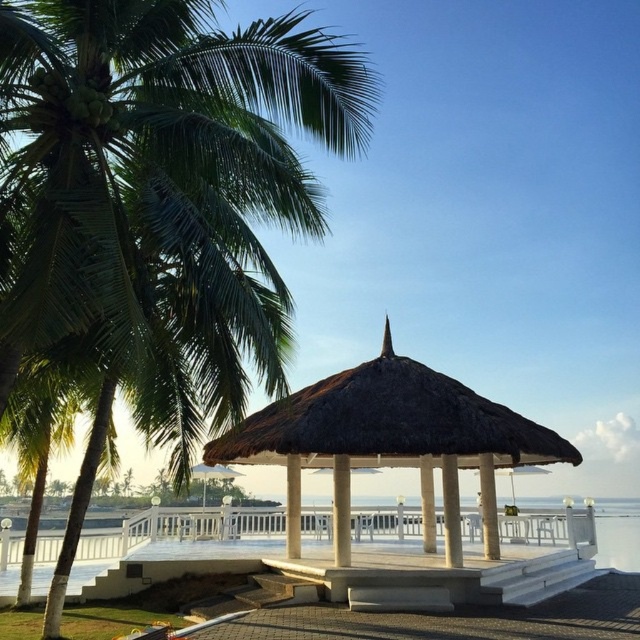
Question: Is green leafy palm tree at left thinner than thatched wood gazebo at center?

Choices:
 (A) yes
 (B) no

Answer: (B)

Question: In this image, where is green leafy palm tree at left located relative to thatched wood gazebo at center?

Choices:
 (A) left
 (B) right

Answer: (A)

Question: Does green leafy palm tree at left come behind thatched wood gazebo at center?

Choices:
 (A) yes
 (B) no

Answer: (B)